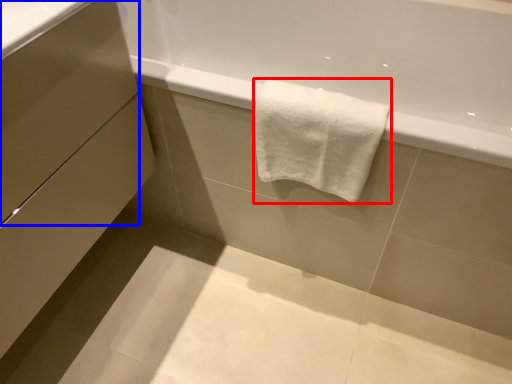
Question: Among these objects, which one is nearest to the camera, towel (highlighted by a red box) or drawer (highlighted by a blue box)?

Choices:
 (A) towel
 (B) drawer

Answer: (B)